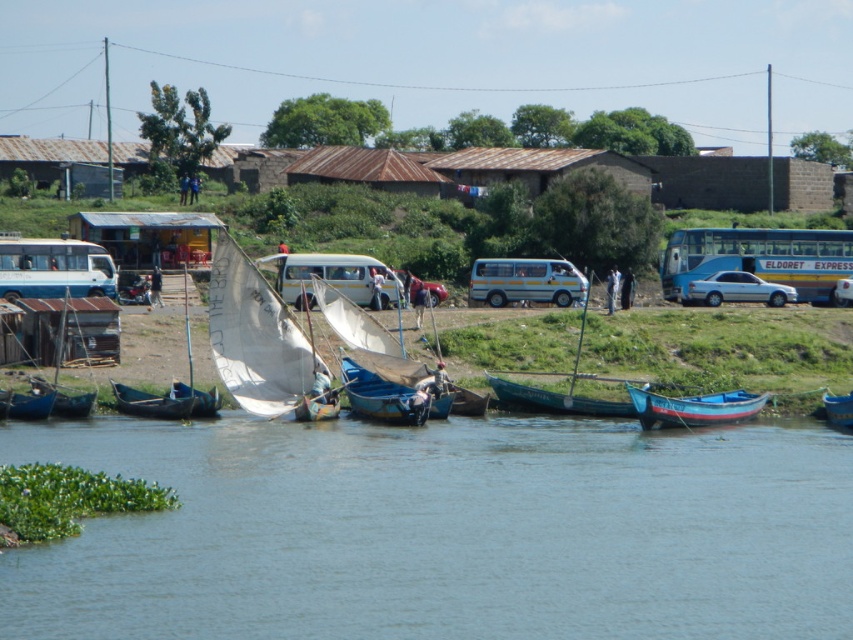
You are standing on the riverside and want to board the closest boat to you. Which boat should you choose between the white sailboat at center and the blue painted wooden boat at lower right?

The white sailboat at center is closer to you since it is further to the viewer than the blue painted wooden boat at lower right.

You are standing at the riverside and want to take a photo of the blue wooden boats at lower center and the white matte van at center. Which object is positioned closer to you?

The blue wooden boats at lower center are closer to the viewer than the white matte van at center.

You are planning to take a photo of the white matte bus at left and the wooden sailboat at lower left from a position where both are visible. Given their sizes, which object will appear bigger in your photo?

The white matte bus at left will appear bigger in the photo because it has a larger size compared to the wooden sailboat at lower left.